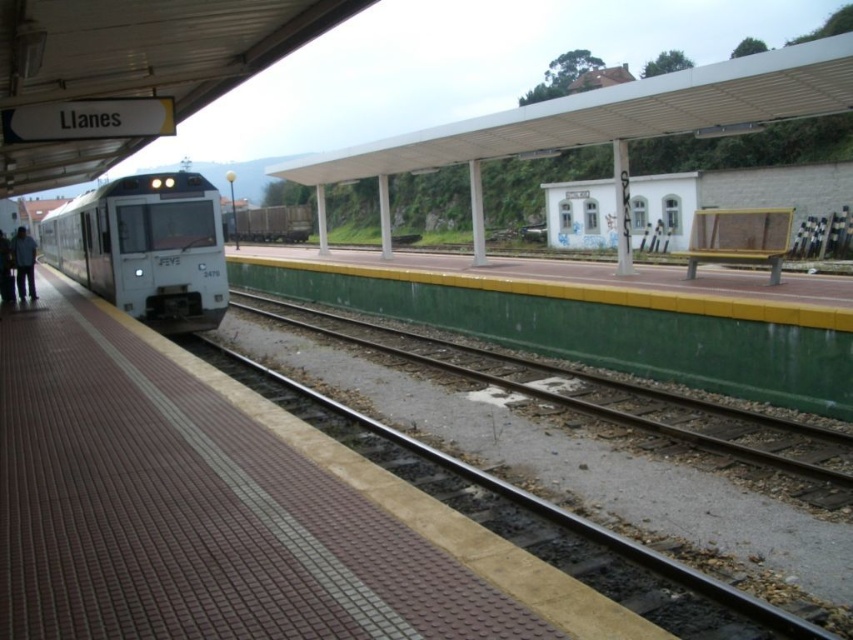
Is metal train track at center to the right of brown wooden train at center from the viewer's perspective?

Correct, you'll find metal train track at center to the right of brown wooden train at center.

At what (x,y) coordinates should I click in order to perform the action: click on metal train track at center. Please return your answer as a coordinate pair (x, y). Image resolution: width=853 pixels, height=640 pixels. Looking at the image, I should click on (531, 518).

Is green concrete train track at center to the left of dark blue jeans at left from the viewer's perspective?

No, green concrete train track at center is not to the left of dark blue jeans at left.

Who is more distant from viewer, (403, 348) or (25, 291)?

Point (25, 291)

Does point (709, 417) come behind point (26, 236)?

No, it is in front of (26, 236).

Locate an element on the screen. The image size is (853, 640). green concrete train track at center is located at coordinates (596, 396).

Is point (753, 464) behind point (167, 305)?

No.

Which of these two, green concrete train track at center or white glossy train at left, stands shorter?

With less height is green concrete train track at center.

Does point (434, 342) come in front of point (199, 284)?

No, (434, 342) is behind (199, 284).

You are a GUI agent. You are given a task and a screenshot of the screen. Output one action in this format:
    pyautogui.click(x=<x>, y=<y>)
    Task: Click on the green concrete train track at center
    
    Given the screenshot: What is the action you would take?
    pyautogui.click(x=596, y=396)